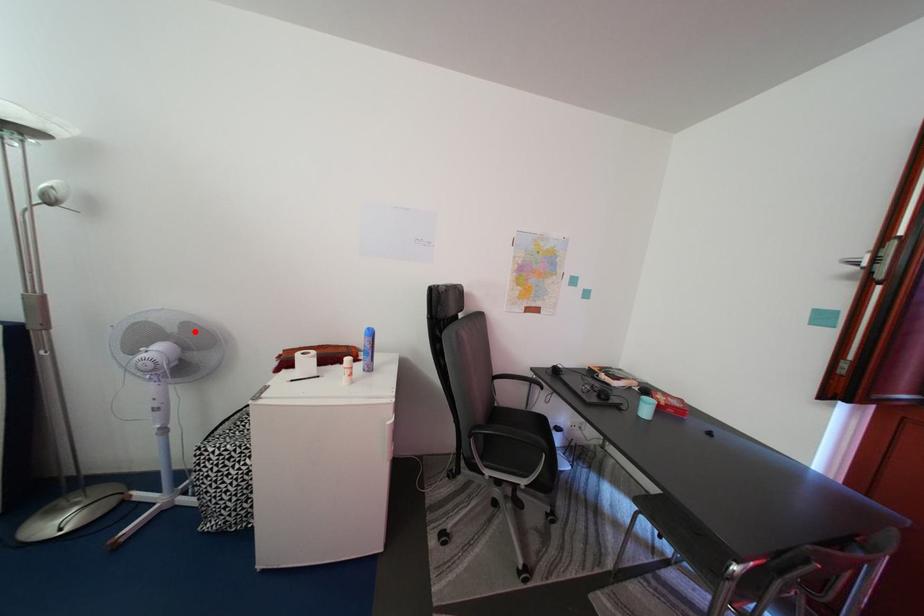
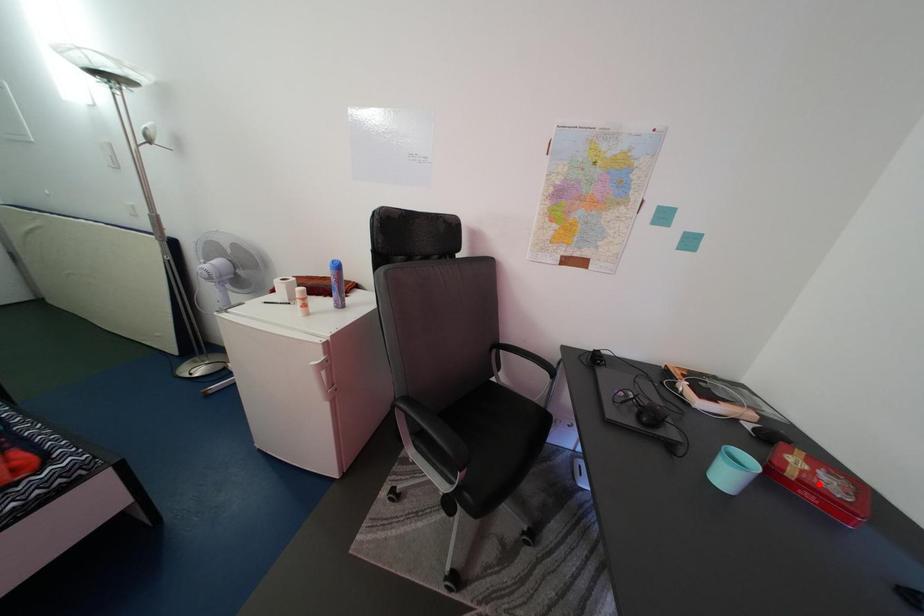
Consider the image. I am providing you with two images of the same scene from different viewpoints. A red point is marked on the first image and another point is marked on the second image. Is the red point in image1 aligned with the point shown in image2?

No